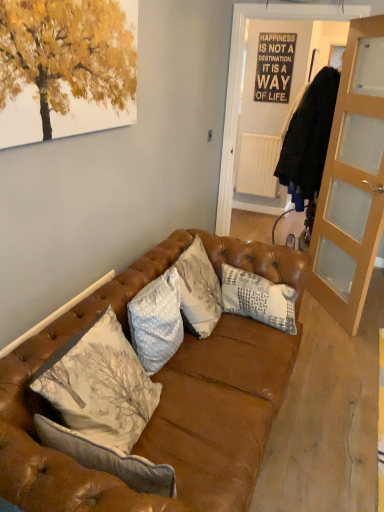
Question: Considering the relative sizes of gray textured pillow at center, which is the 2th pillow in left-to-right order, and light brown glass cabinet at right in the image provided, is gray textured pillow at center, which is the 2th pillow in left-to-right order, taller than light brown glass cabinet at right?

Choices:
 (A) yes
 (B) no

Answer: (B)

Question: From a real-world perspective, is gray textured pillow at center, which is the 2th pillow in left-to-right order, located beneath light brown glass cabinet at right?

Choices:
 (A) yes
 (B) no

Answer: (A)

Question: Does gray textured pillow at center, the first pillow positioned from the right, appear on the right side of light brown glass cabinet at right?

Choices:
 (A) yes
 (B) no

Answer: (B)

Question: Are gray textured pillow at center, the first pillow positioned from the right, and light brown glass cabinet at right far apart?

Choices:
 (A) yes
 (B) no

Answer: (A)

Question: From the image's perspective, is gray textured pillow at center, the first pillow positioned from the right, on top of light brown glass cabinet at right?

Choices:
 (A) yes
 (B) no

Answer: (B)

Question: Considering the positions of light gray textured pillow at center, acting as the 1th pillow starting from the left, and gray textured pillow at center, which is the 2th pillow in left-to-right order, in the image, is light gray textured pillow at center, acting as the 1th pillow starting from the left, taller or shorter than gray textured pillow at center, which is the 2th pillow in left-to-right order,?

Choices:
 (A) tall
 (B) short

Answer: (B)

Question: From a real-world perspective, is light gray textured pillow at center, which is counted as the first pillow, starting from the front, positioned above or below gray textured pillow at center, acting as the 2th pillow starting from the front?

Choices:
 (A) below
 (B) above

Answer: (B)

Question: In terms of size, does light gray textured pillow at center, placed as the second pillow when sorted from back to front, appear bigger or smaller than gray textured pillow at center, which is the first pillow in back-to-front order?

Choices:
 (A) small
 (B) big

Answer: (A)

Question: In the image, is light gray textured pillow at center, acting as the 1th pillow starting from the left, positioned in front of or behind gray textured pillow at center, which is the 2th pillow in left-to-right order?

Choices:
 (A) behind
 (B) front

Answer: (B)

Question: From the image's perspective, relative to leather couch at center, is white matte radiator at center above or below?

Choices:
 (A) above
 (B) below

Answer: (A)

Question: Is white matte radiator at center bigger or smaller than leather couch at center?

Choices:
 (A) big
 (B) small

Answer: (B)

Question: Considering the positions of white matte radiator at center and leather couch at center in the image, is white matte radiator at center taller or shorter than leather couch at center?

Choices:
 (A) short
 (B) tall

Answer: (A)

Question: From a real-world perspective, is white matte radiator at center physically located above or below leather couch at center?

Choices:
 (A) below
 (B) above

Answer: (B)

Question: Looking at the image, does light brown glass cabinet at right seem bigger or smaller compared to leather couch at center?

Choices:
 (A) big
 (B) small

Answer: (B)

Question: Is light brown glass cabinet at right inside the boundaries of leather couch at center, or outside?

Choices:
 (A) inside
 (B) outside

Answer: (B)